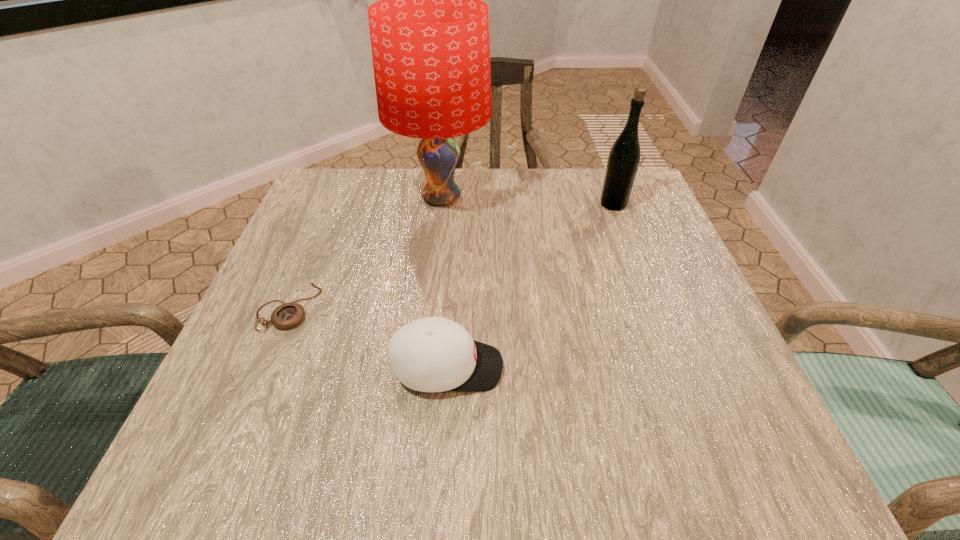
This screenshot has width=960, height=540. I want to click on vacant space in between the pocket watch and the lampshade, so click(365, 252).

Locate an element on the screen. free space between the nearest object and the leftmost object is located at coordinates (368, 337).

Locate an element on the screen. This screenshot has height=540, width=960. vacant area that lies between the leftmost object and the lampshade is located at coordinates (365, 252).

At what (x,y) coordinates should I click in order to perform the action: click on object that can be found as the third closest to the third tallest object. Please return your answer as a coordinate pair (x, y). Image resolution: width=960 pixels, height=540 pixels. Looking at the image, I should click on (624, 157).

Locate which object is the closest to the rightmost object. Please provide its 2D coordinates. Your answer should be formatted as a tuple, i.e. [(x, y)], where the tuple contains the x and y coordinates of a point satisfying the conditions above.

[(429, 33)]

Identify the location of vacant region that satisfies the following two spatial constraints: 1. on the front-facing side of the lampshade; 2. on the right side of the second tallest object. The image size is (960, 540). (441, 204).

This screenshot has width=960, height=540. Identify the location of free spot that satisfies the following two spatial constraints: 1. on the back side of the rightmost object; 2. on the front-facing side of the tallest object. (611, 198).

Where is `free spot that satisfies the following two spatial constraints: 1. on the back side of the shortest object; 2. on the right side of the rightmost object`? This screenshot has width=960, height=540. free spot that satisfies the following two spatial constraints: 1. on the back side of the shortest object; 2. on the right side of the rightmost object is located at coordinates point(331,204).

The height and width of the screenshot is (540, 960). I want to click on vacant area in the image that satisfies the following two spatial constraints: 1. on the front-facing side of the lampshade; 2. on the left side of the rightmost object, so click(x=441, y=204).